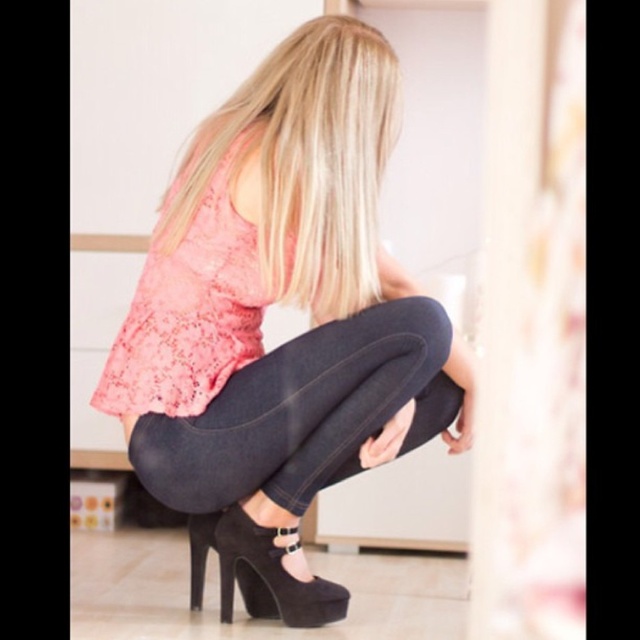
Question: Which point appears closest to the camera in this image?

Choices:
 (A) (291, 148)
 (B) (176, 465)
 (C) (384, 61)

Answer: (A)

Question: Which point is closer to the camera?

Choices:
 (A) dark denim jeans at center
 (B) suede black high-heeled shoe at lower center

Answer: (A)

Question: Which point is closer to the camera?

Choices:
 (A) (316, 609)
 (B) (228, 572)
 (C) (449, 346)
 (D) (364, 241)

Answer: (D)

Question: Does matte black shoes at center appear on the right side of suede black high-heeled shoe at lower center?

Choices:
 (A) no
 (B) yes

Answer: (B)

Question: Can you confirm if blonde smooth hair at center is wider than dark denim jeans at center?

Choices:
 (A) no
 (B) yes

Answer: (A)

Question: Does matte black shoes at center have a lesser width compared to suede black high-heeled shoe at lower center?

Choices:
 (A) no
 (B) yes

Answer: (A)